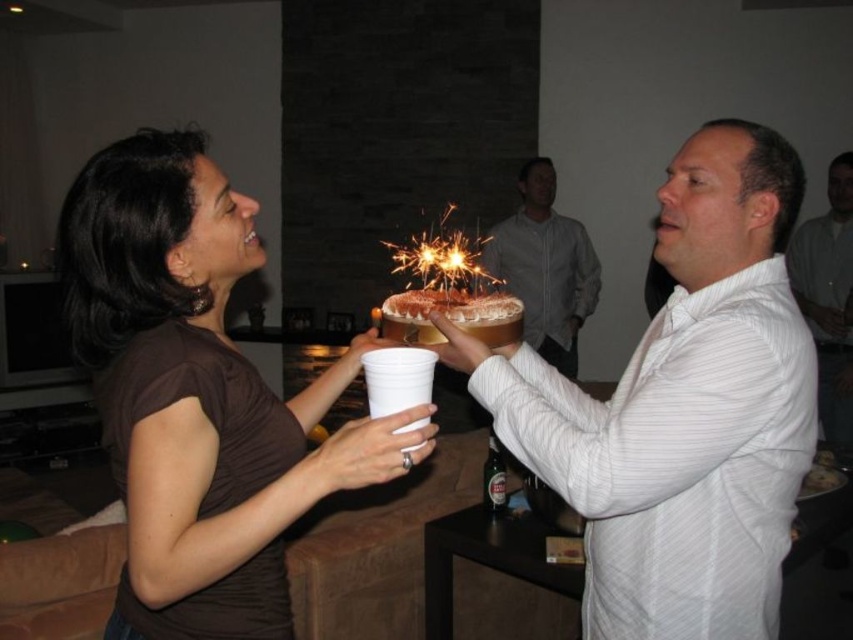
Question: Among these points, which one is nearest to the camera?

Choices:
 (A) (496, 298)
 (B) (425, 387)
 (C) (836, 260)

Answer: (B)

Question: Which point is farther to the camera?

Choices:
 (A) matte gray shirt at center
 (B) white plastic cup at center
 (C) white striped shirt at right
 (D) white striped shirt at center

Answer: (A)

Question: Where is white striped shirt at center located in relation to chocolate frosted cake at center in the image?

Choices:
 (A) left
 (B) right

Answer: (B)

Question: Which point is closer to the camera?

Choices:
 (A) sparkling golden cake at center
 (B) white striped shirt at right
 (C) chocolate frosted cake at center

Answer: (C)

Question: Can you confirm if white striped shirt at center is positioned to the right of matte gray shirt at center?

Choices:
 (A) no
 (B) yes

Answer: (A)

Question: Does white striped shirt at right come in front of chocolate frosted cake at center?

Choices:
 (A) yes
 (B) no

Answer: (B)